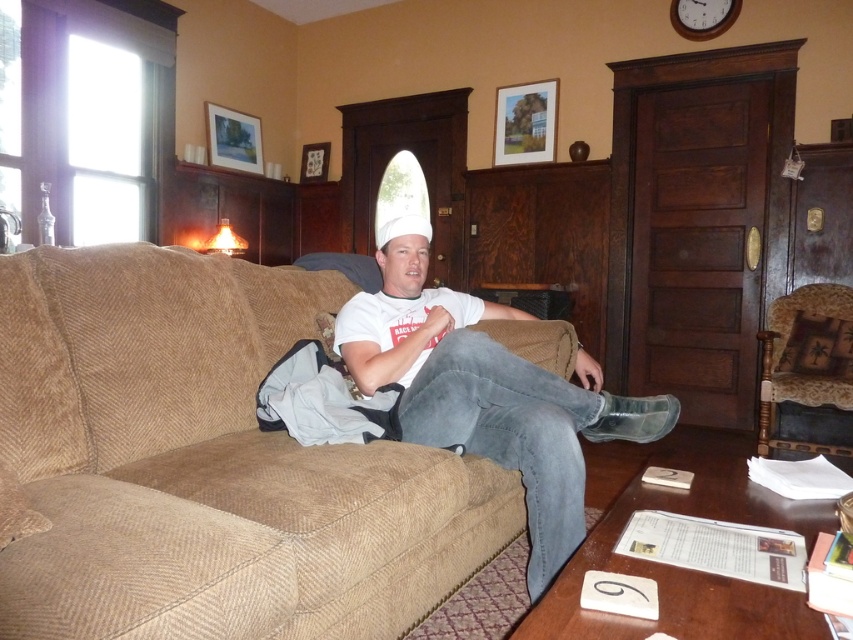
Question: In this image, where is white matte t-shirt at center located relative to patterned fabric armchair at right?

Choices:
 (A) above
 (B) below

Answer: (A)

Question: Which object is closer to the camera taking this photo?

Choices:
 (A) patterned fabric armchair at right
 (B) brown fabric couch at center
 (C) white matte t-shirt at center

Answer: (B)

Question: Is white matte t-shirt at center to the left of patterned fabric armchair at right from the viewer's perspective?

Choices:
 (A) yes
 (B) no

Answer: (A)

Question: Is white matte t-shirt at center positioned at the back of patterned fabric armchair at right?

Choices:
 (A) yes
 (B) no

Answer: (B)

Question: Which is farther from the white matte t-shirt at center?

Choices:
 (A) patterned fabric armchair at right
 (B) brown fabric couch at center

Answer: (A)

Question: Among these objects, which one is farthest from the camera?

Choices:
 (A) patterned fabric armchair at right
 (B) white matte t-shirt at center
 (C) brown fabric couch at center

Answer: (A)